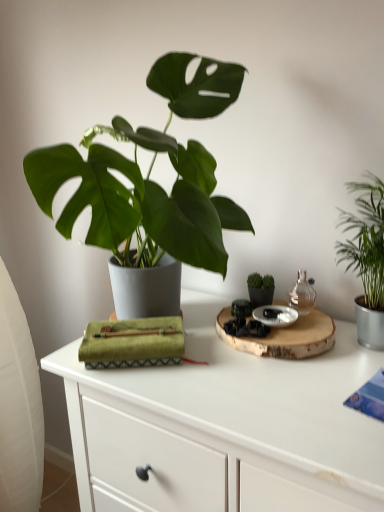
At what (x,y) coordinates should I click in order to perform the action: click on vacant space situated on the left part of matte black pot at center. Please return your answer as a coordinate pair (x, y). The height and width of the screenshot is (512, 384). Looking at the image, I should click on (197, 323).